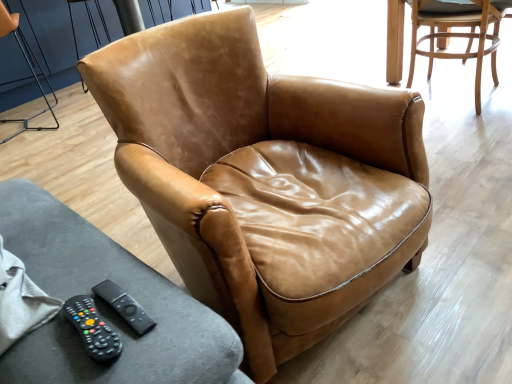
Question: Is black rubber remote at lower left, placed as the first remote when sorted from back to front, surrounded by cognac leather armchair at center, the second chair viewed from the left?

Choices:
 (A) yes
 (B) no

Answer: (B)

Question: Is cognac leather armchair at center, which ranks as the 2th chair in right-to-left order, completely or partially outside of black rubber remote at lower left, placed as the first remote when sorted from back to front?

Choices:
 (A) yes
 (B) no

Answer: (A)

Question: Is cognac leather armchair at center, the second chair viewed from the left, oriented towards black rubber remote at lower left, the second remote in the front-to-back sequence?

Choices:
 (A) yes
 (B) no

Answer: (B)

Question: Does cognac leather armchair at center, the second chair viewed from the left, have a lesser width compared to black rubber remote at lower left, the second remote in the front-to-back sequence?

Choices:
 (A) no
 (B) yes

Answer: (A)

Question: Does cognac leather armchair at center, the second chair viewed from the left, lie behind black rubber remote at lower left, placed as the first remote when sorted from back to front?

Choices:
 (A) no
 (B) yes

Answer: (A)

Question: Is the surface of cognac leather armchair at center, which ranks as the 2th chair in right-to-left order, in direct contact with black rubber remote at lower left, the second remote in the front-to-back sequence?

Choices:
 (A) no
 (B) yes

Answer: (A)

Question: Considering the relative positions of light brown leather chair at upper right, positioned as the 3th chair in left-to-right order, and brown leather armchair at upper center, which is counted as the 1th chair, starting from the left, in the image provided, is light brown leather chair at upper right, positioned as the 3th chair in left-to-right order, to the left of brown leather armchair at upper center, which is counted as the 1th chair, starting from the left, from the viewer's perspective?

Choices:
 (A) no
 (B) yes

Answer: (A)

Question: Is light brown leather chair at upper right, which is the 1th chair in right-to-left order, located outside brown leather armchair at upper center, which is counted as the 1th chair, starting from the left?

Choices:
 (A) yes
 (B) no

Answer: (A)

Question: Does light brown leather chair at upper right, positioned as the 3th chair in left-to-right order, have a smaller size compared to brown leather armchair at upper center, which is counted as the 1th chair, starting from the left?

Choices:
 (A) no
 (B) yes

Answer: (A)

Question: Can brown leather armchair at upper center, which appears as the 3th chair when viewed from the right, be found inside light brown leather chair at upper right, which is the 1th chair in right-to-left order?

Choices:
 (A) yes
 (B) no

Answer: (B)

Question: From the image's perspective, would you say light brown leather chair at upper right, positioned as the 3th chair in left-to-right order, is positioned over brown leather armchair at upper center, which is counted as the 1th chair, starting from the left?

Choices:
 (A) no
 (B) yes

Answer: (B)

Question: Considering the relative sizes of light brown leather chair at upper right, which is the 1th chair in right-to-left order, and brown leather armchair at upper center, which is counted as the 1th chair, starting from the left, in the image provided, is light brown leather chair at upper right, which is the 1th chair in right-to-left order, wider than brown leather armchair at upper center, which is counted as the 1th chair, starting from the left,?

Choices:
 (A) no
 (B) yes

Answer: (B)

Question: Can you confirm if black rubber remote at lower left, which is the first remote from front to back, is smaller than brown leather armchair at upper center, which appears as the 3th chair when viewed from the right?

Choices:
 (A) yes
 (B) no

Answer: (A)